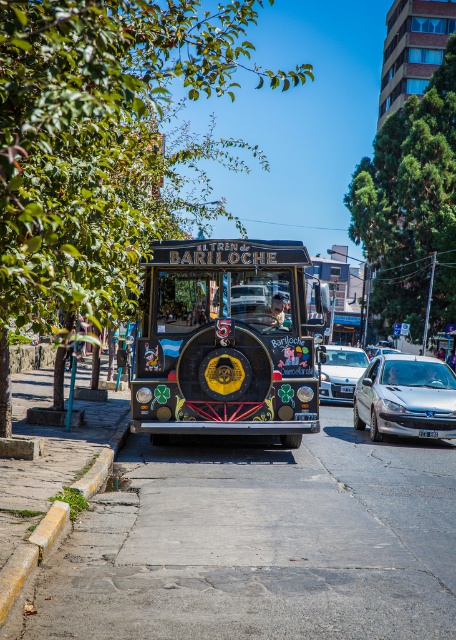
You are a pedestrian standing on the sidewalk to the left of the train. You want to cross the road to reach a store on the other side. There is a decorative painted bus at center and a silver metallic car at center in your path. Which vehicle should you avoid stepping over first?

The decorative painted bus at center is located above the silver metallic car at center, so you should avoid stepping over the decorative painted bus at center first since it is closer to you.

You are a photographer planning to take a photo of the decorative painted bus at center and the silver metallic car at right from a low angle to emphasize their sizes. Which vehicle should you focus on to highlight its height more effectively?

The decorative painted bus at center has a greater height compared to the silver metallic car at right, so focusing on it will better emphasize its height.

You are a photographer standing on the sidewalk next to the yellow concrete curb at lower left. You want to take a photo of the silver metallic car at right through the trees. Will the car be taller than the curb in your photo?

The silver metallic car at right is taller than the yellow concrete curb at lower left, so yes, the car will appear taller than the curb in your photo.